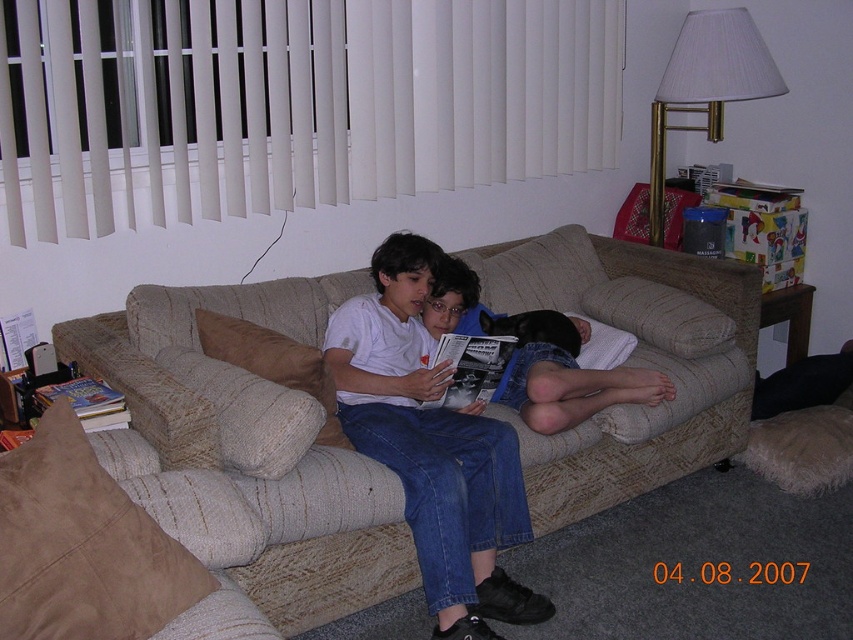
What are the coordinates of the white vertical blinds at upper center?

The white vertical blinds at upper center are located at coordinates point (376, 99).

You are a person who wants to place a 2.5 feet long decorative item between the gold metallic lampshade at upper right and the black glossy magazine at center. Is there enough space to place it without moving either object?

The gold metallic lampshade at upper right and the black glossy magazine at center are 4.31 feet apart from each other. Since the decorative item is 2.5 feet long, there is enough space to place it between them without moving either object.